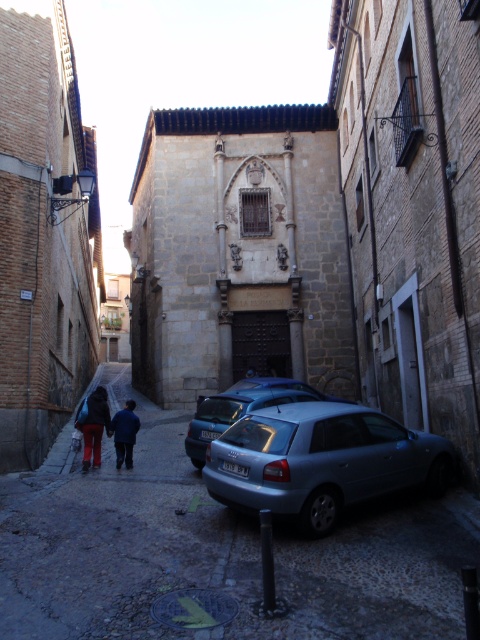
Question: Which is nearer to the satin silver car at center?

Choices:
 (A) silver metallic car at center
 (B) dark blue jeans at lower left
 (C) blue fabric jacket at center
 (D) metallic silver car at center

Answer: (A)

Question: Does satin silver car at center have a larger size compared to blue fabric jacket at center?

Choices:
 (A) yes
 (B) no

Answer: (A)

Question: Estimate the real-world distances between objects in this image. Which object is farther from the dark blue jeans at lower left?

Choices:
 (A) satin silver car at center
 (B) metallic silver car at center
 (C) silver metallic car at center

Answer: (A)

Question: Is silver metallic car at center to the right of satin silver car at center from the viewer's perspective?

Choices:
 (A) yes
 (B) no

Answer: (B)

Question: Which is farther from the metallic silver car at center?

Choices:
 (A) silver metallic car at center
 (B) satin silver car at center

Answer: (B)

Question: Is silver metallic car at center in front of dark blue jeans at lower left?

Choices:
 (A) no
 (B) yes

Answer: (B)